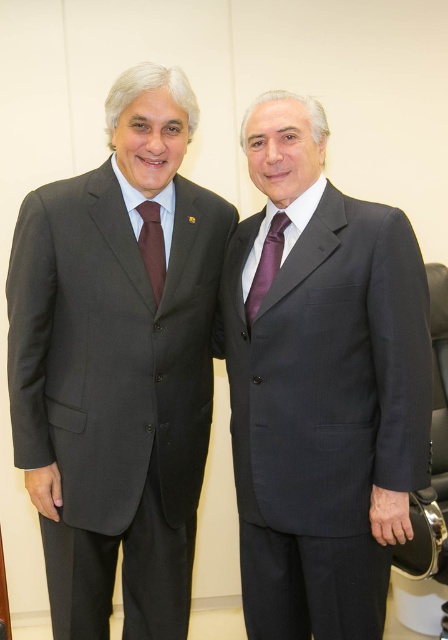
Question: Estimate the real-world distances between objects in this image. Which object is farther from the purple satin tie at center?

Choices:
 (A) matte black suit at left
 (B) dark gray suit at center

Answer: (A)

Question: Which of the following is the closest to the observer?

Choices:
 (A) brown silk tie at left
 (B) purple satin tie at center

Answer: (B)

Question: Is dark gray suit at center to the right of brown silk tie at left from the viewer's perspective?

Choices:
 (A) yes
 (B) no

Answer: (A)

Question: Does dark gray suit at center appear on the left side of matte black suit at left?

Choices:
 (A) yes
 (B) no

Answer: (B)

Question: Does dark gray suit at center have a greater width compared to purple satin tie at center?

Choices:
 (A) no
 (B) yes

Answer: (B)

Question: Among these points, which one is nearest to the camera?

Choices:
 (A) (166, 216)
 (B) (146, 250)

Answer: (B)